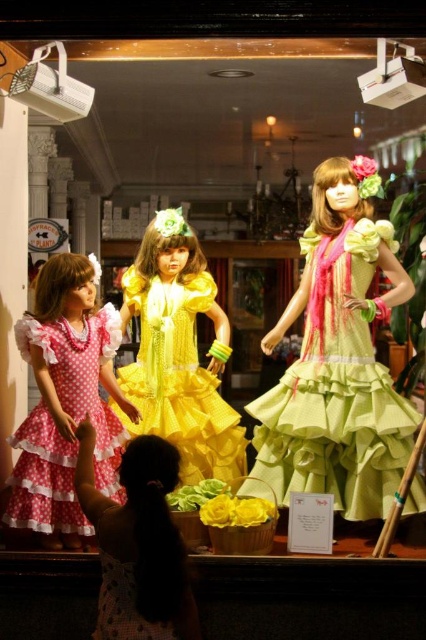
You are standing in front of the display window and want to touch the yellow satin dress at center. Based on its position coordinates, can you estimate whether it is located towards the left or right side of the window?

The yellow satin dress at center is located at coordinates point (178, 378), which places it near the center of the window. Therefore, it is not towards the left or right side but rather in the middle.

You are a photographer standing at the camera position. You want to take a closeup shot of the green satin dress at center. What should you do to get closer to the dress?

The green satin dress at center is 4.39 meters from camera. To get closer, you should move forward 4.39 meters towards the dress.